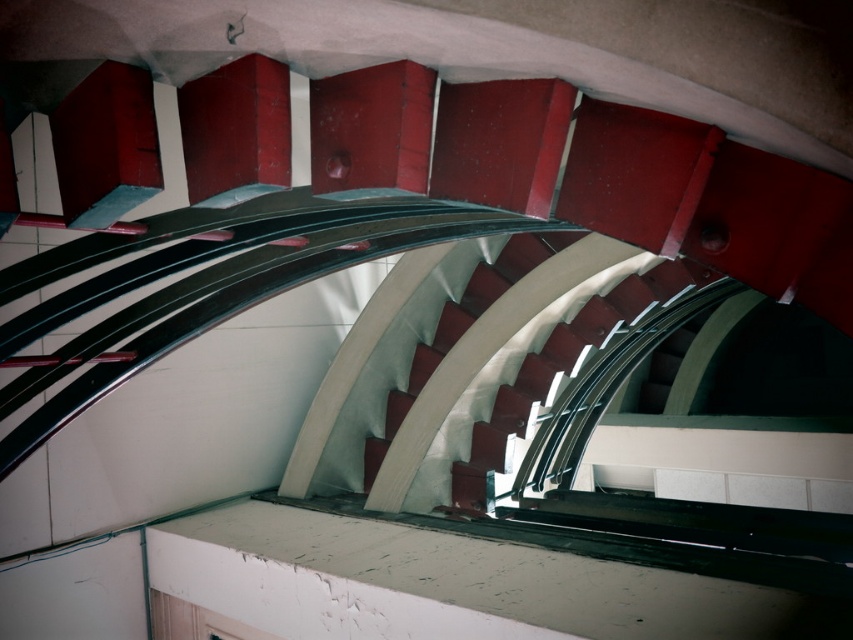
Between smooth white stair at center and white glossy stair at center, which one appears on the right side from the viewer's perspective?

Positioned to the right is smooth white stair at center.

Does point (500, 472) come behind point (410, 392)?

No, it is in front of (410, 392).

Find the location of a particular element. Image resolution: width=853 pixels, height=640 pixels. smooth white stair at center is located at coordinates (561, 368).

I want to click on smooth white stair at center, so click(561, 368).